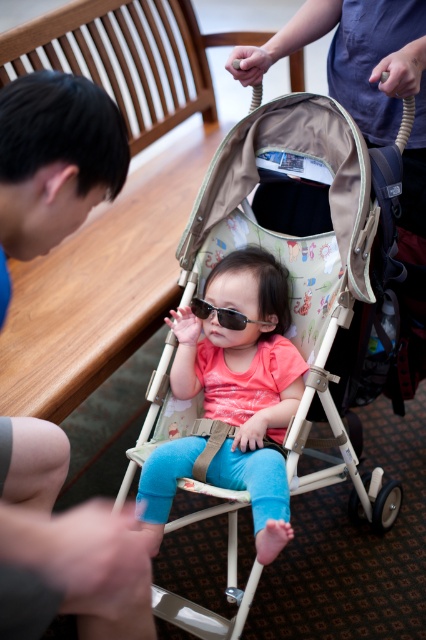
You are a fashion designer looking at two shirts in an image. You see a blue fabric shirt at left and a matte pink shirt at center. Which shirt is positioned more to the left?

The blue fabric shirt at left is positioned more to the left than the matte pink shirt at center.

You are a fashion designer observing a baby in a stroller. The baby is wearing a blue fabric shirt at left and a matte pink shirt at center. Which shirt is narrower?

The blue fabric shirt at left has a lesser width compared to matte pink shirt at center, so the blue fabric shirt at left is narrower.